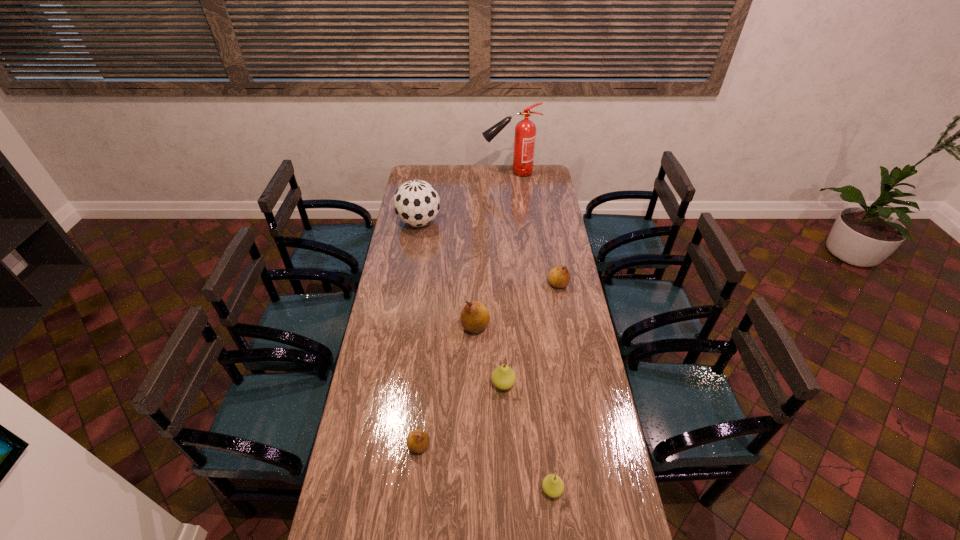
Where is `the nearer green pear`? The image size is (960, 540). the nearer green pear is located at coordinates (553, 486).

You are a GUI agent. You are given a task and a screenshot of the screen. Output one action in this format:
    pyautogui.click(x=<x>, y=<y>)
    Task: Click on the smaller green pear
    This screenshot has width=960, height=540.
    Given the screenshot: What is the action you would take?
    pyautogui.click(x=553, y=486)

Identify the location of the leftmost brown pear. This screenshot has height=540, width=960. (418, 441).

Locate an element on the screen. This screenshot has width=960, height=540. the sixth farthest object is located at coordinates (418, 441).

Locate an element on the screen. free point located 0.120m at the nozzle end of the red fire extinguisher is located at coordinates (463, 172).

Find the location of a particular element. vacant point located at the nozzle end of the red fire extinguisher is located at coordinates (442, 172).

Image resolution: width=960 pixels, height=540 pixels. I want to click on free spot located 0.390m at the nozzle end of the red fire extinguisher, so click(x=419, y=172).

This screenshot has width=960, height=540. Identify the location of free point located 0.350m on the front of the soccer ball. (409, 284).

Locate an element on the screen. The height and width of the screenshot is (540, 960). vacant space located on the back of the third tallest object is located at coordinates (475, 296).

At what (x,y) coordinates should I click in order to perform the action: click on vacant space positioned on the left of the second biggest brown pear. Please return your answer as a coordinate pair (x, y). Image resolution: width=960 pixels, height=540 pixels. Looking at the image, I should click on (491, 284).